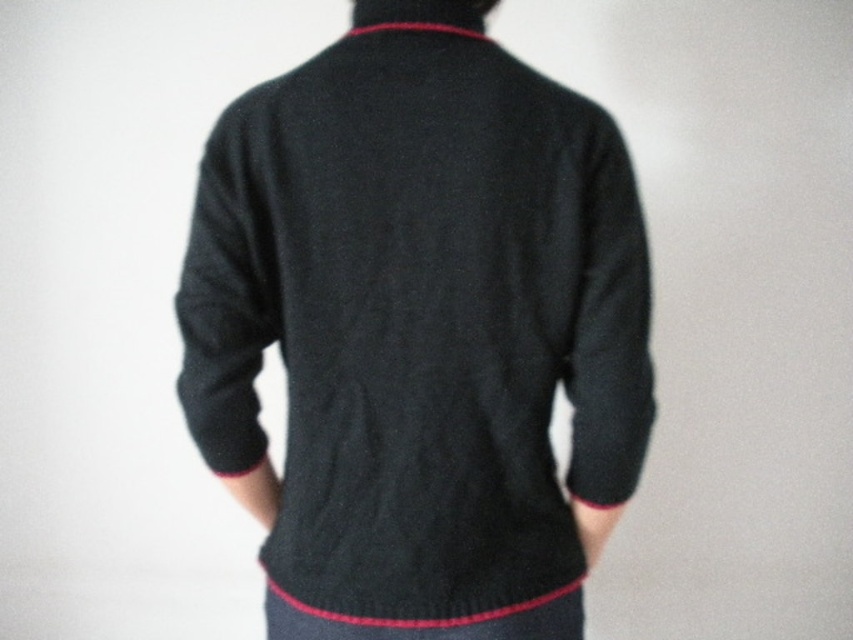
You are a fashion designer examining the image of a person wearing a dark gray wool sweater at center and a red knitted neckband at center. Which clothing item is located above the other?

The red knitted neckband at center is above the dark gray wool sweater at center since the sweater is positioned under the neckband.

You are a fashion designer examining a model wearing a dark gray wool sweater at center and a red knitted neckband at center. Which item is located to the left of the other?

The dark gray wool sweater at center is positioned on the left side of red knitted neckband at center.

You are an assistant helping someone choose an outfit. The person wants to know if the dark gray wool sweater at center is positioned in the middle of the image. Can you confirm this based on the coordinates provided?

The dark gray wool sweater at center is located at point (419, 337), which is very close to the center coordinates of an image typically being around (426, 320). Therefore, it can be considered positioned in the middle of the image.